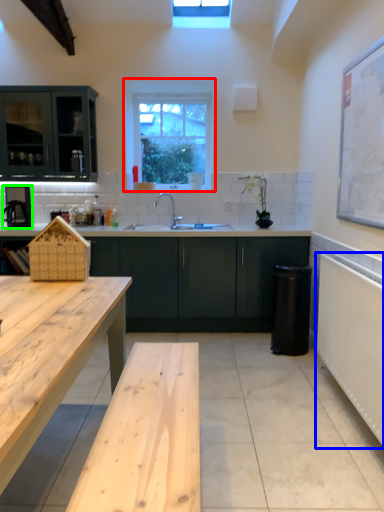
Question: Based on their relative distances, which object is farther from window (highlighted by a red box)? Choose from radiator (highlighted by a blue box) and appliance (highlighted by a green box).

Choices:
 (A) radiator
 (B) appliance

Answer: (A)